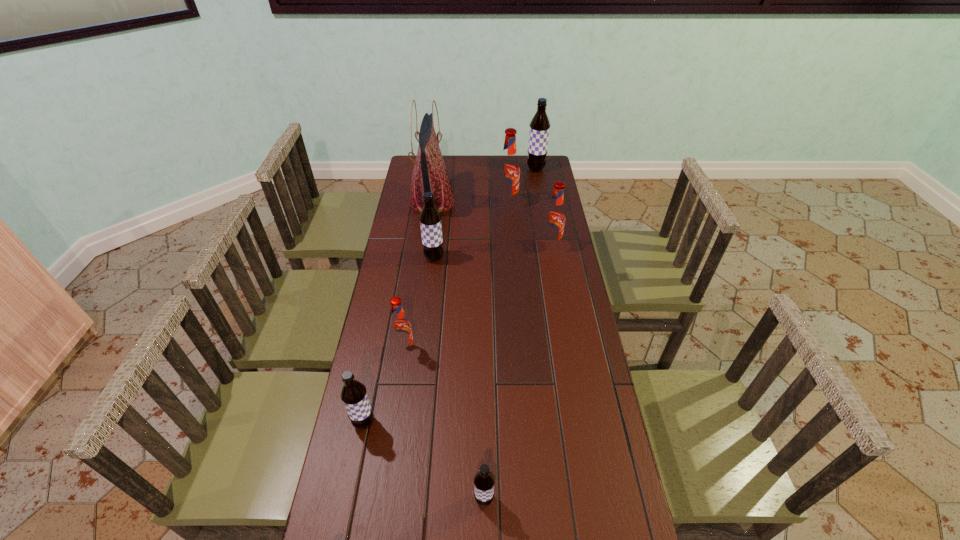
At what (x,y) coordinates should I click in order to perform the action: click on free space between the second brown root beer from right to left and the biggest brown root beer. Please return your answer as a coordinate pair (x, y). The width and height of the screenshot is (960, 540). Looking at the image, I should click on (510, 334).

You are a GUI agent. You are given a task and a screenshot of the screen. Output one action in this format:
    pyautogui.click(x=<x>, y=<y>)
    Task: Click on the free spot between the nearest red root beer and the biggest red root beer
    The width and height of the screenshot is (960, 540).
    Given the screenshot: What is the action you would take?
    pyautogui.click(x=456, y=276)

This screenshot has height=540, width=960. Find the location of `vacant space that is in between the second smallest brown root beer and the second brown root beer from right to left`. vacant space that is in between the second smallest brown root beer and the second brown root beer from right to left is located at coordinates (424, 461).

The height and width of the screenshot is (540, 960). Identify the location of vacant area between the biggest red root beer and the fifth farthest root beer. (456, 276).

Find the location of a particular element. empty space that is in between the farthest red root beer and the third nearest brown root beer is located at coordinates (470, 231).

Identify the location of vacant space in between the biggest red root beer and the smallest red root beer. Image resolution: width=960 pixels, height=540 pixels. (456, 276).

Where is `empty space that is in between the second nearest red root beer and the rightmost brown root beer`? empty space that is in between the second nearest red root beer and the rightmost brown root beer is located at coordinates (543, 207).

Identify the location of free spot between the third biggest brown root beer and the sixth object from left to right. The width and height of the screenshot is (960, 540). (436, 313).

I want to click on vacant space that's between the handbag and the farthest brown root beer, so click(484, 185).

Find the location of a particular element. The image size is (960, 540). object that is the fourth closest to the second farthest brown root beer is located at coordinates (554, 220).